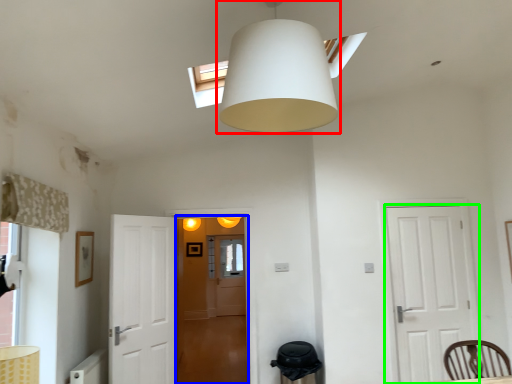
Question: Based on their relative distances, which object is farther from lamp (highlighted by a red box)? Choose from glass door (highlighted by a blue box) and door (highlighted by a green box).

Choices:
 (A) glass door
 (B) door

Answer: (A)